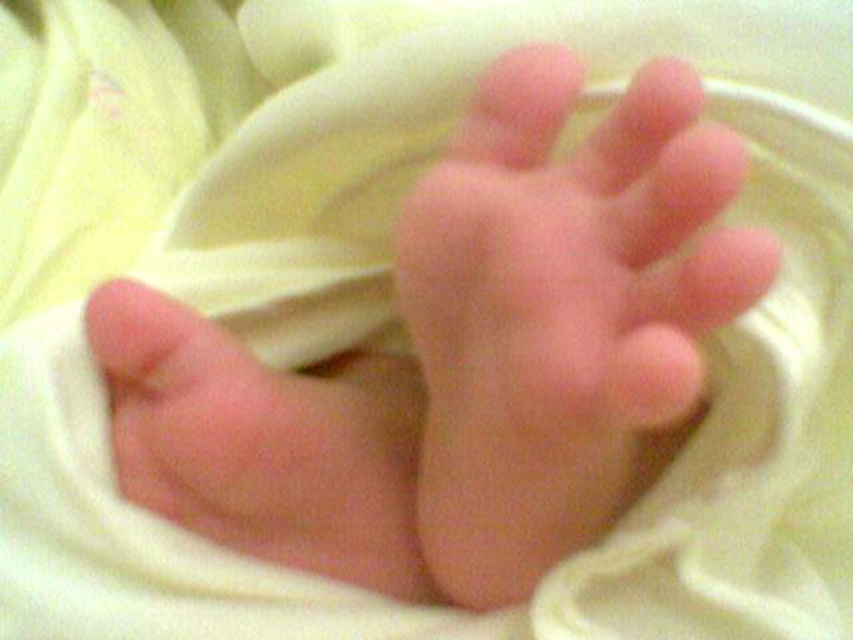
Question: Which point appears farthest from the camera in this image?

Choices:
 (A) (142, 400)
 (B) (241, 396)

Answer: (A)

Question: Can you confirm if pink smooth skin at center is positioned below pink smooth skin at lower left?

Choices:
 (A) no
 (B) yes

Answer: (A)

Question: In this image, where is pink smooth skin at center located relative to pink smooth skin at lower left?

Choices:
 (A) below
 (B) above

Answer: (B)

Question: Is pink smooth skin at center thinner than pink smooth skin at lower left?

Choices:
 (A) yes
 (B) no

Answer: (B)

Question: Which point is farther to the camera?

Choices:
 (A) (490, 349)
 (B) (346, 531)

Answer: (B)